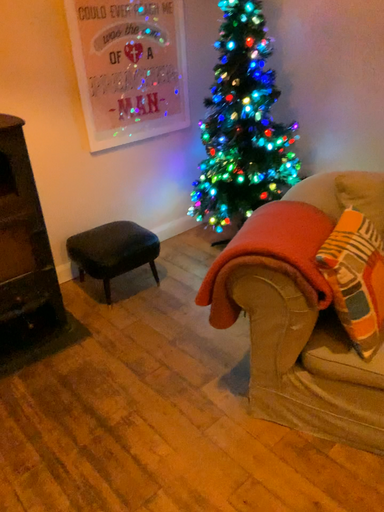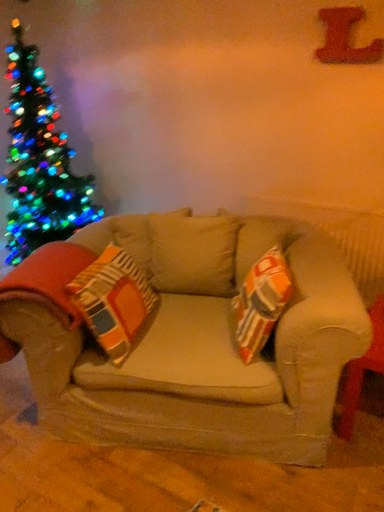
Question: Which way did the camera rotate in the video?

Choices:
 (A) rotated right
 (B) rotated left

Answer: (A)